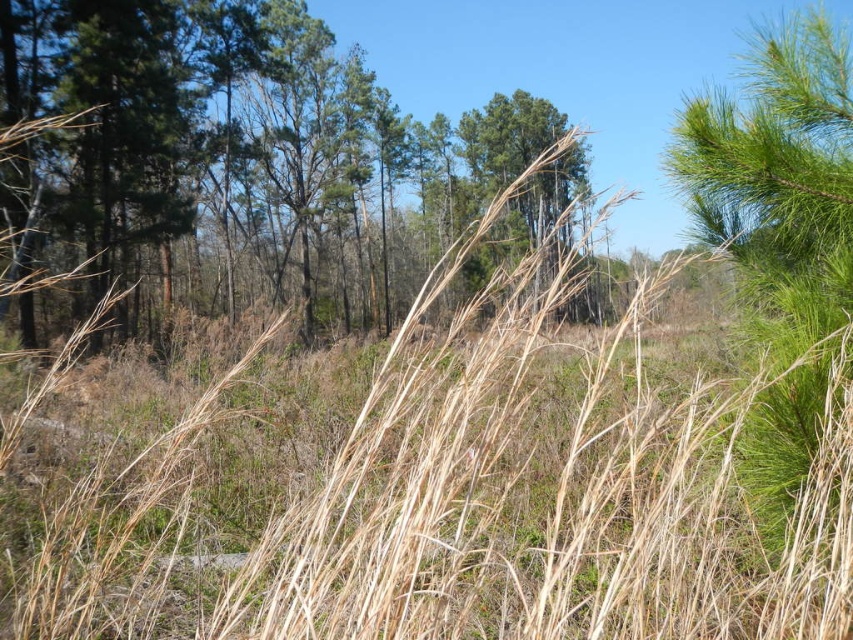
You are standing in the natural outdoor scene described. You see two points marked in the image. Which point is closer to you, point [186,180] or point [761,419]?

Point [186,180] is closer to you because it is further to the viewer than point [761,419].